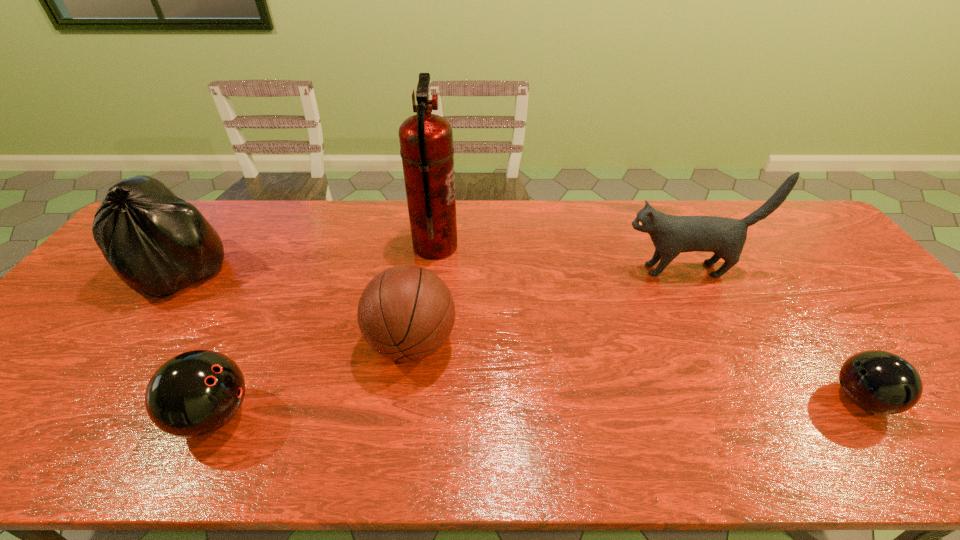
The image size is (960, 540). What are the coordinates of `object that is at the left edge` in the screenshot? It's located at [x=157, y=243].

Image resolution: width=960 pixels, height=540 pixels. Find the location of `object that is at the far left corner`. object that is at the far left corner is located at coordinates (157, 243).

In the image, there is a desktop. At what (x,y) coordinates should I click in order to perform the action: click on vacant region at the far edge. Please return your answer as a coordinate pair (x, y). The width and height of the screenshot is (960, 540). Looking at the image, I should click on (307, 213).

In the image, there is a desktop. Identify the location of free space at the near edge. (661, 464).

Find the location of a particular element. vacant space at the left edge is located at coordinates (90, 295).

Find the location of a particular element. free space at the right edge is located at coordinates (834, 295).

Identify the location of free location at the near right corner of the desktop. Image resolution: width=960 pixels, height=540 pixels. (959, 463).

In order to click on empty space between the cat and the shorter bowling ball in this screenshot , I will do `click(773, 334)`.

I want to click on unoccupied position between the cat and the fire extinguisher, so click(560, 258).

You are a GUI agent. You are given a task and a screenshot of the screen. Output one action in this format:
    pyautogui.click(x=<x>, y=<y>)
    Task: Click on the free space between the leftmost object and the shortest object
    Image resolution: width=960 pixels, height=540 pixels.
    Given the screenshot: What is the action you would take?
    pyautogui.click(x=521, y=335)